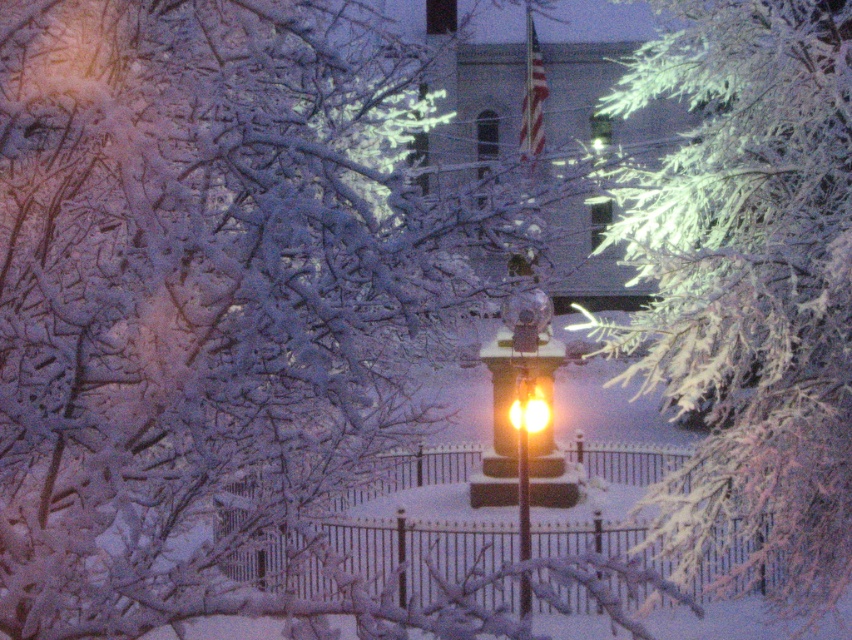
Question: Does matte black street light at center appear on the right side of yellow glass streetlight at center?

Choices:
 (A) yes
 (B) no

Answer: (B)

Question: Is matte black street light at center closer to camera compared to yellow glass streetlight at center?

Choices:
 (A) yes
 (B) no

Answer: (A)

Question: Which of the following is the farthest from the observer?

Choices:
 (A) matte black street light at center
 (B) matte glass street light at center

Answer: (B)

Question: Which point is closer to the camera taking this photo?

Choices:
 (A) (521, 474)
 (B) (538, 403)
 (C) (358, 492)

Answer: (A)

Question: Does metallic iron fence at center have a greater width compared to yellow glass streetlight at center?

Choices:
 (A) no
 (B) yes

Answer: (B)

Question: Which point is closer to the camera taking this photo?

Choices:
 (A) pyautogui.click(x=770, y=515)
 (B) pyautogui.click(x=517, y=484)
 (C) pyautogui.click(x=539, y=417)
 (D) pyautogui.click(x=502, y=317)

Answer: (A)